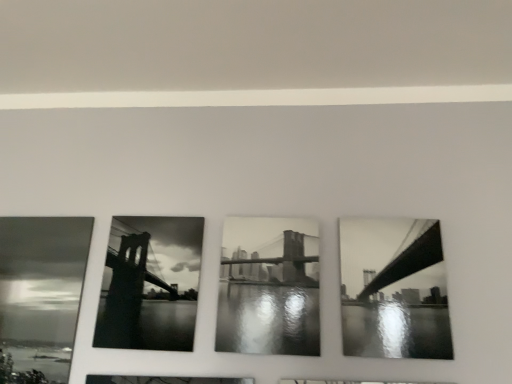
Question: Is black glossy photo frame at center, placed as the 3th picture frame when sorted from right to left, oriented away from black glossy bridge at right, which is the third picture frame in left-to-right order?

Choices:
 (A) yes
 (B) no

Answer: (B)

Question: Would you say black glossy photo frame at center, placed as the 3th picture frame when sorted from right to left, contains black glossy bridge at right, which is the third picture frame in left-to-right order?

Choices:
 (A) yes
 (B) no

Answer: (B)

Question: Is black glossy photo frame at center, arranged as the 1th picture frame when viewed from the left, next to black glossy bridge at right, positioned as the 1th picture frame in right-to-left order, and touching it?

Choices:
 (A) yes
 (B) no

Answer: (B)

Question: Is black glossy photo frame at center, arranged as the 1th picture frame when viewed from the left, positioned far away from black glossy bridge at right, positioned as the 1th picture frame in right-to-left order?

Choices:
 (A) no
 (B) yes

Answer: (A)

Question: Can you confirm if black glossy photo frame at center, arranged as the 1th picture frame when viewed from the left, is thinner than black glossy bridge at right, positioned as the 1th picture frame in right-to-left order?

Choices:
 (A) no
 (B) yes

Answer: (B)

Question: Can you confirm if black glossy photo frame at center, placed as the 3th picture frame when sorted from right to left, is taller than black glossy bridge at right, positioned as the 1th picture frame in right-to-left order?

Choices:
 (A) no
 (B) yes

Answer: (B)

Question: Is black glossy photo frame at center, arranged as the 1th picture frame when viewed from the left, bigger than black and white photograph of bridge at center, placed as the second picture frame when sorted from right to left?

Choices:
 (A) no
 (B) yes

Answer: (B)

Question: From the image's perspective, is black glossy photo frame at center, arranged as the 1th picture frame when viewed from the left, located beneath black and white photograph of bridge at center, placed as the second picture frame when sorted from right to left?

Choices:
 (A) no
 (B) yes

Answer: (B)

Question: From a real-world perspective, is black glossy photo frame at center, placed as the 3th picture frame when sorted from right to left, physically above black and white photograph of bridge at center, which appears as the second picture frame when viewed from the left?

Choices:
 (A) no
 (B) yes

Answer: (A)

Question: Is black and white photograph of bridge at center, which appears as the second picture frame when viewed from the left, inside black glossy photo frame at center, placed as the 3th picture frame when sorted from right to left?

Choices:
 (A) yes
 (B) no

Answer: (B)

Question: From the image's perspective, is black glossy photo frame at center, placed as the 3th picture frame when sorted from right to left, located above black and white photograph of bridge at center, placed as the second picture frame when sorted from right to left?

Choices:
 (A) yes
 (B) no

Answer: (B)

Question: Is black glossy photo frame at center, placed as the 3th picture frame when sorted from right to left, beside black and white photograph of bridge at center, placed as the second picture frame when sorted from right to left?

Choices:
 (A) yes
 (B) no

Answer: (B)

Question: From a real-world perspective, is black glossy bridge at right, positioned as the 1th picture frame in right-to-left order, positioned under black and white photograph of bridge at center, which appears as the second picture frame when viewed from the left, based on gravity?

Choices:
 (A) yes
 (B) no

Answer: (B)